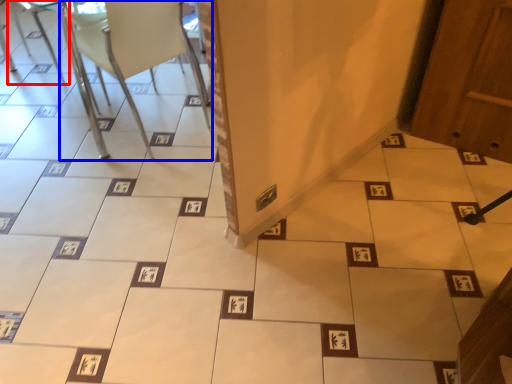
Question: Which object appears farthest to the camera in this image, armchair (highlighted by a red box) or chair (highlighted by a blue box)?

Choices:
 (A) armchair
 (B) chair

Answer: (A)